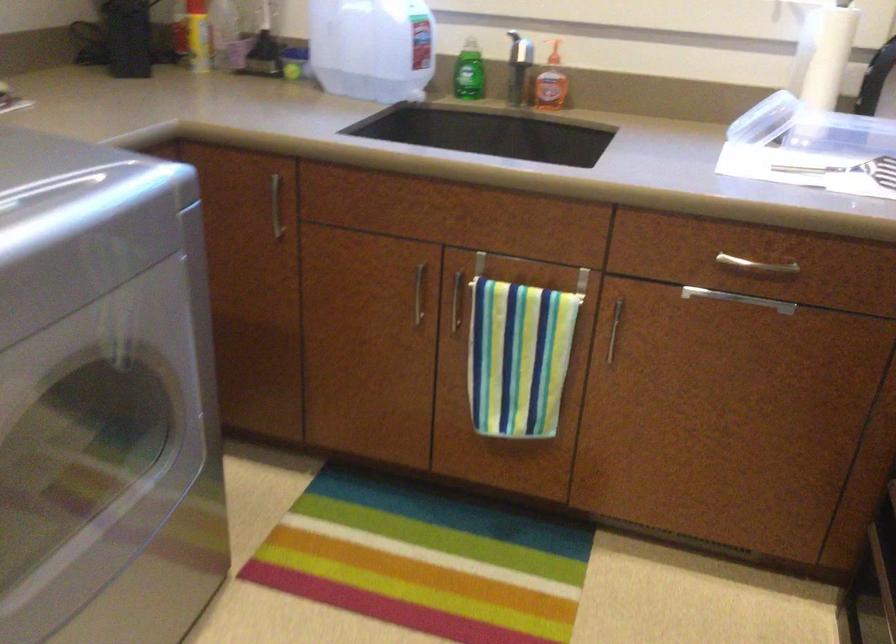
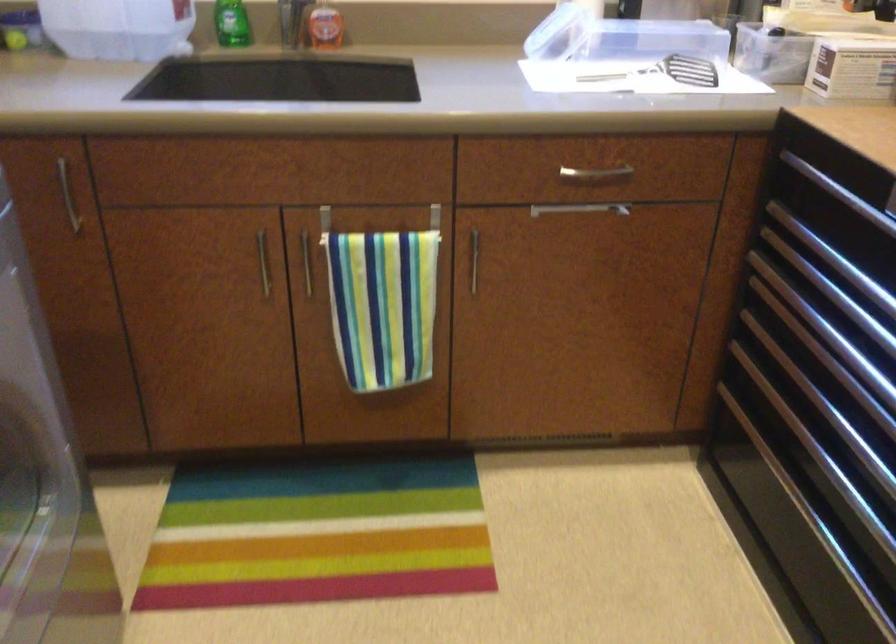
Question: The camera is either moving clockwise (left) or counter-clockwise (right) around the object. The first image is from the beginning of the video and the second image is from the end. Is the camera moving left or right when shooting the video?

Choices:
 (A) Left
 (B) Right

Answer: (A)